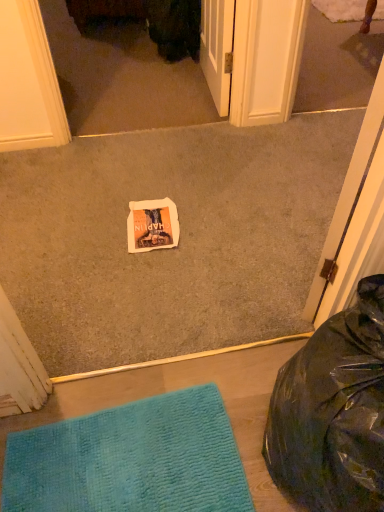
You are a GUI agent. You are given a task and a screenshot of the screen. Output one action in this format:
    pyautogui.click(x=<x>, y=<y>)
    Task: Click on the black plastic bean bag chair at lower right
    Image resolution: width=384 pixels, height=512 pixels.
    Given the screenshot: What is the action you would take?
    pyautogui.click(x=333, y=412)

Find the location of a particular element. Image resolution: width=384 pixels, height=512 pixels. matte white screen door at upper center is located at coordinates (122, 78).

This screenshot has width=384, height=512. I want to click on white paper at center, so click(180, 238).

At what (x,y) coordinates should I click in order to perform the action: click on teal textured mat at lower left. Please return your answer as a coordinate pair (x, y). The image size is (384, 512). Looking at the image, I should click on (131, 460).

From a real-world perspective, is black plastic bean bag chair at lower right on top of matte white screen door at upper center?

Yes, from a real-world perspective, black plastic bean bag chair at lower right is on top of matte white screen door at upper center.

Does black plastic bean bag chair at lower right have a larger size compared to matte white screen door at upper center?

Yes.

Is black plastic bean bag chair at lower right located outside matte white screen door at upper center?

That's correct, black plastic bean bag chair at lower right is outside of matte white screen door at upper center.

From a real-world perspective, between white paper at center and black plastic bean bag chair at lower right, who is vertically lower?

From a 3D spatial view, white paper at center is below.

Does white paper at center turn towards black plastic bean bag chair at lower right?

Yes, white paper at center is facing black plastic bean bag chair at lower right.

From the image's perspective, which one is positioned higher, white paper at center or black plastic bean bag chair at lower right?

white paper at center appears higher in the image.

Can you confirm if white paper at center is wider than black plastic bean bag chair at lower right?

Correct, the width of white paper at center exceeds that of black plastic bean bag chair at lower right.

Is white paper at center outside of white paper at center?

Yes, white paper at center is located beyond the bounds of white paper at center.

From a real-world perspective, which object rests below the other?

From a 3D spatial view, white paper at center is below.

Which is more distant, [122,227] or [153,228]?

Point [122,227]

Looking at this image, is white paper at center at the left side of white paper at center?

No.

From a real-world perspective, is matte white screen door at upper center positioned under white paper at center based on gravity?

Correct, in the physical world, matte white screen door at upper center is lower than white paper at center.

The height and width of the screenshot is (512, 384). There is a matte white screen door at upper center. Identify the location of concrete above it (from a real-world perspective). (180, 238).

Can you confirm if matte white screen door at upper center is bigger than white paper at center?

Yes.

Considering the sizes of objects teal textured mat at lower left and black plastic bean bag chair at lower right in the image provided, who is bigger, teal textured mat at lower left or black plastic bean bag chair at lower right?

black plastic bean bag chair at lower right is bigger.

Is teal textured mat at lower left located outside black plastic bean bag chair at lower right?

teal textured mat at lower left is positioned outside black plastic bean bag chair at lower right.

From a real-world perspective, is teal textured mat at lower left located beneath black plastic bean bag chair at lower right?

Yes, from a real-world perspective, teal textured mat at lower left is beneath black plastic bean bag chair at lower right.

Can you tell me how much teal textured mat at lower left and black plastic bean bag chair at lower right differ in facing direction?

89.6 degrees.

Which is more to the right, teal textured mat at lower left or matte white screen door at upper center?

teal textured mat at lower left is more to the right.

Can you see teal textured mat at lower left touching matte white screen door at upper center?

No.

How far apart are teal textured mat at lower left and matte white screen door at upper center?

teal textured mat at lower left is 1.84 meters from matte white screen door at upper center.

Is teal textured mat at lower left completely or partially outside of matte white screen door at upper center?

Yes.

Is white paper at center far away from matte white screen door at upper center?

No, white paper at center is not far from matte white screen door at upper center.

From the picture: Could you tell me if white paper at center is turned towards matte white screen door at upper center?

No.

From the image's perspective, is white paper at center on matte white screen door at upper center?

Actually, white paper at center appears below matte white screen door at upper center in the image.

The image size is (384, 512). What are the coordinates of `screen door located behind the black plastic bean bag chair at lower right` in the screenshot? It's located at (122, 78).

In the image, there is a black plastic bean bag chair at lower right. What are the coordinates of `concrete above it (from the image's perspective)` in the screenshot? It's located at (180, 238).

Looking at the image, which one is located further to teal textured mat at lower left, white paper at center or matte white screen door at upper center?

Based on the image, matte white screen door at upper center appears to be further to teal textured mat at lower left.

Considering their positions, is white paper at center positioned closer to black plastic bean bag chair at lower right than teal textured mat at lower left?

teal textured mat at lower left is closer to black plastic bean bag chair at lower right.

Considering their positions, is teal textured mat at lower left positioned closer to white paper at center than black plastic bean bag chair at lower right?

teal textured mat at lower left is positioned closer to the anchor white paper at center.

When comparing their distances from matte white screen door at upper center, does white paper at center or teal textured mat at lower left seem further?

Based on the image, teal textured mat at lower left appears to be further to matte white screen door at upper center.

Estimate the real-world distances between objects in this image. Which object is further from white paper at center, black plastic bean bag chair at lower right or matte white screen door at upper center?

Based on the image, black plastic bean bag chair at lower right appears to be further to white paper at center.

When comparing their distances from white paper at center, does teal textured mat at lower left or matte white screen door at upper center seem closer?

Among the two, teal textured mat at lower left is located nearer to white paper at center.

Which object lies nearer to the anchor point white paper at center, black plastic bean bag chair at lower right or white paper at center?

Among the two, white paper at center is located nearer to white paper at center.

Which object lies further to the anchor point black plastic bean bag chair at lower right, matte white screen door at upper center or white paper at center?

The object further to black plastic bean bag chair at lower right is matte white screen door at upper center.

This screenshot has height=512, width=384. I want to click on postcard between white paper at center and teal textured mat at lower left vertically, so coord(152,225).

Identify the location of bean bag chair between matte white screen door at upper center and teal textured mat at lower left vertically. The image size is (384, 512). (333, 412).

This screenshot has width=384, height=512. I want to click on concrete that lies between matte white screen door at upper center and teal textured mat at lower left from top to bottom, so click(180, 238).

Where is `postcard between matte white screen door at upper center and black plastic bean bag chair at lower right vertically`? postcard between matte white screen door at upper center and black plastic bean bag chair at lower right vertically is located at coordinates (152, 225).